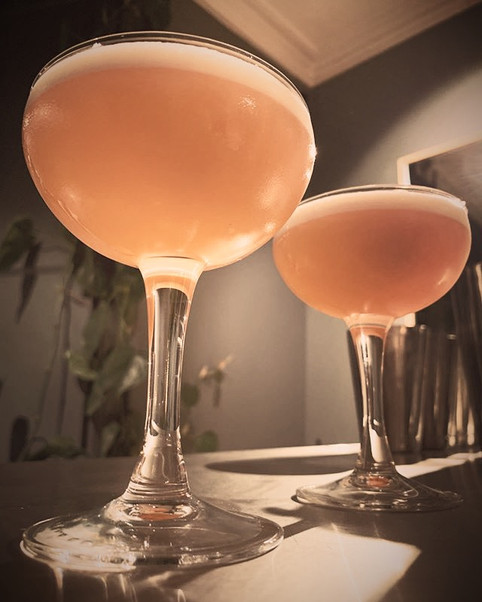
In order to click on glass stem in this screenshot , I will do `click(168, 344)`, `click(366, 374)`.